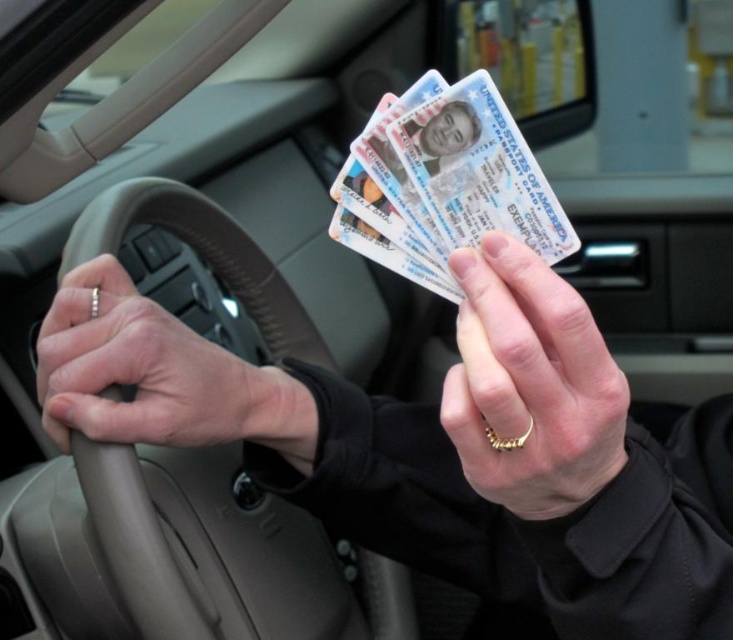
Between point (460, 392) and point (139, 385), which one is positioned in front?

Point (460, 392) is in front.

Who is shorter, gold ring at center or gold ring at left?

Standing shorter between the two is gold ring at left.

Does point (501, 259) come in front of point (265, 372)?

That is True.

Where is `gold ring at center`? The width and height of the screenshot is (733, 640). gold ring at center is located at coordinates 530,385.

Does gold ring at left appear under white plastic id cards at center?

Yes.

Is point (78, 317) positioned after point (457, 196)?

Yes.

Who is more distant from viewer, (250, 406) or (471, 243)?

Point (250, 406)

The width and height of the screenshot is (733, 640). Find the location of `gold ring at left`. gold ring at left is located at coordinates (141, 371).

Where is `gold ring at center`? The image size is (733, 640). gold ring at center is located at coordinates (530, 385).

Is gold ring at center below white plastic id cards at center?

Correct, gold ring at center is located below white plastic id cards at center.

What do you see at coordinates (530, 385) in the screenshot? I see `gold ring at center` at bounding box center [530, 385].

The image size is (733, 640). I want to click on gold ring at center, so click(530, 385).